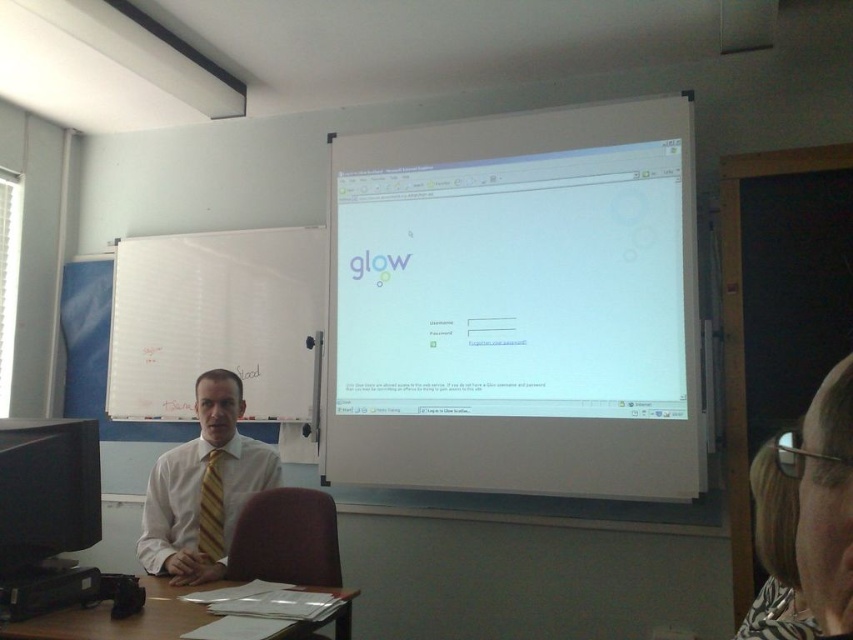
You are a student sitting in the classroom and need to read the text on the white glossy projection screen at upper center. Considering your current position, can you comfortably read the text from where you are sitting?

The white glossy projection screen at upper center is 2.65 meters away from the viewer. Since this distance is within a typical comfortable reading range for a projection screen, you should be able to read the text comfortably from your current position.

Based on the photo, you are a student entering the classroom and need to set up your laptop on the largest available surface. Which object should you choose between the black glossy monitor at left and the brown wooden table at lower left?

The black glossy monitor at left has a larger size compared to the brown wooden table at lower left, so you should choose the black glossy monitor at left as the largest available surface.

You are organizing a small event in this classroom and need to place a rectangular banner that is 1 meter wide between the brown wooden table at lower left and the yellow striped tie at center. Given the spatial relationship between these two objects, will the banner fit without overlapping either object?

The brown wooden table at lower left is wider than the yellow striped tie at center. Since the banner is 1 meter wide, but the exact distance between them isn